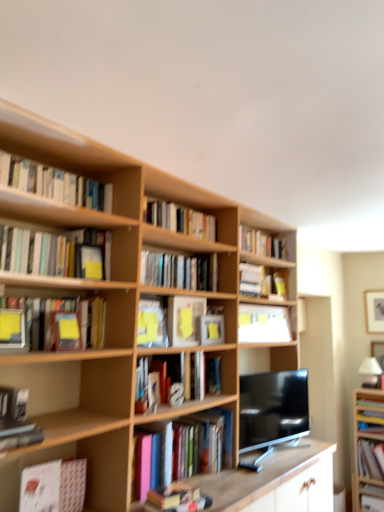
Locate an element on the screen. vacant point above hardcover books at center, the second book in the top-to-bottom sequence (from a real-world perspective) is located at coordinates (184, 200).